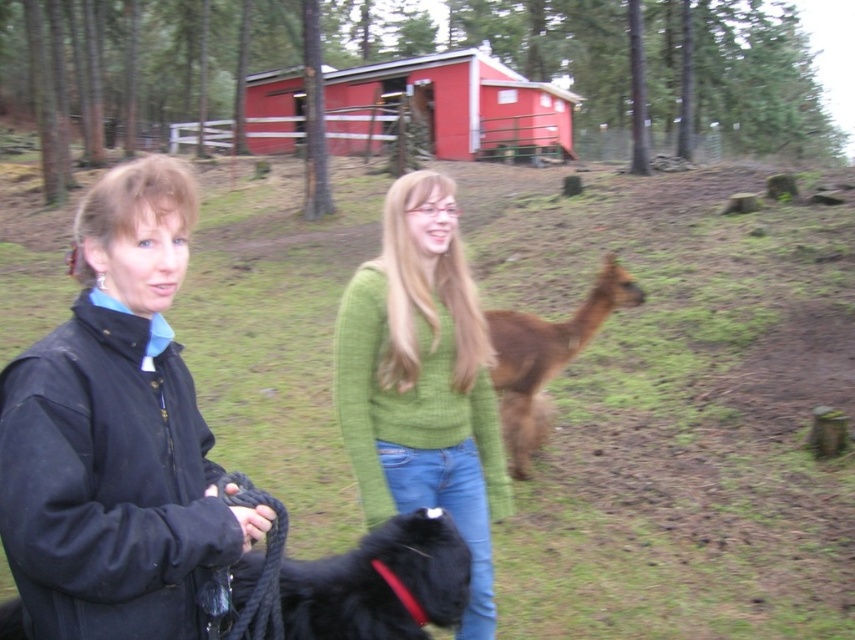
You are a visitor at this farm and want to find the red wood cabin at upper center. From your current position at the black fuzzy dog at lower center, in which direction should you look to see the cabin?

The red wood cabin at upper center is above the black fuzzy dog at lower center, so you should look upwards to see it.

You are planning to build a fence around the red wood cabin at upper center and the brown fuzzy alpaca at center. Which one requires a larger fence area due to its size?

The red wood cabin at upper center requires a larger fence area because it is larger in size than the brown fuzzy alpaca at center.